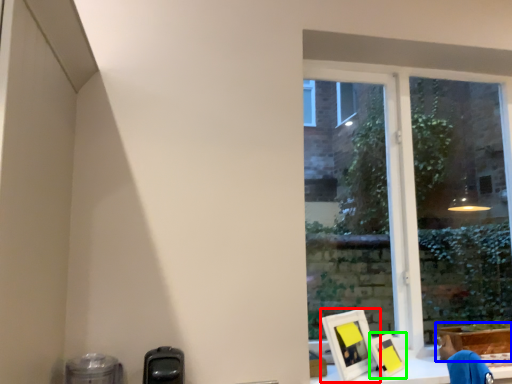
Question: Considering the real-world distances, which object is closest to picture frame (highlighted by a red box)? cardboard box (highlighted by a blue box) or picture frame (highlighted by a green box).

Choices:
 (A) cardboard box
 (B) picture frame

Answer: (B)